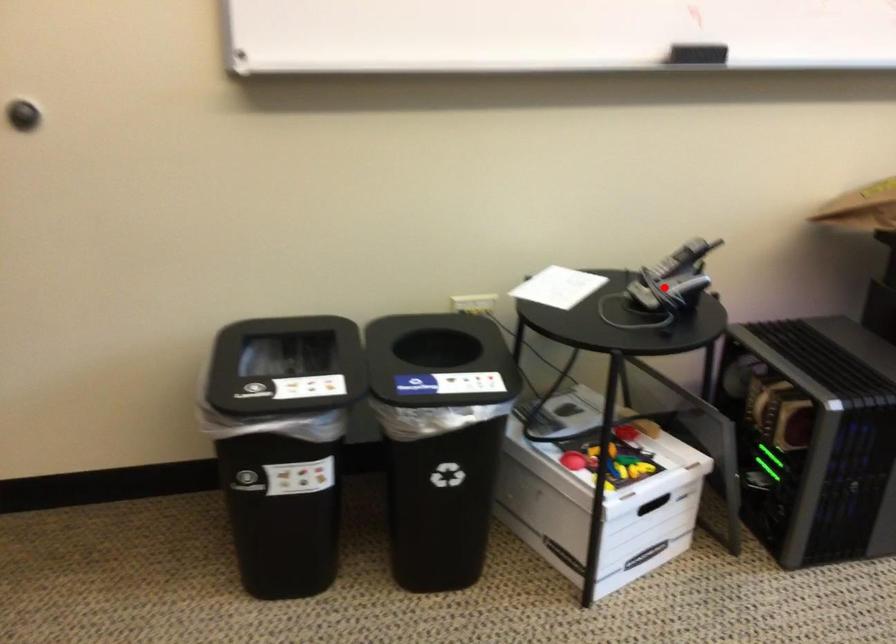
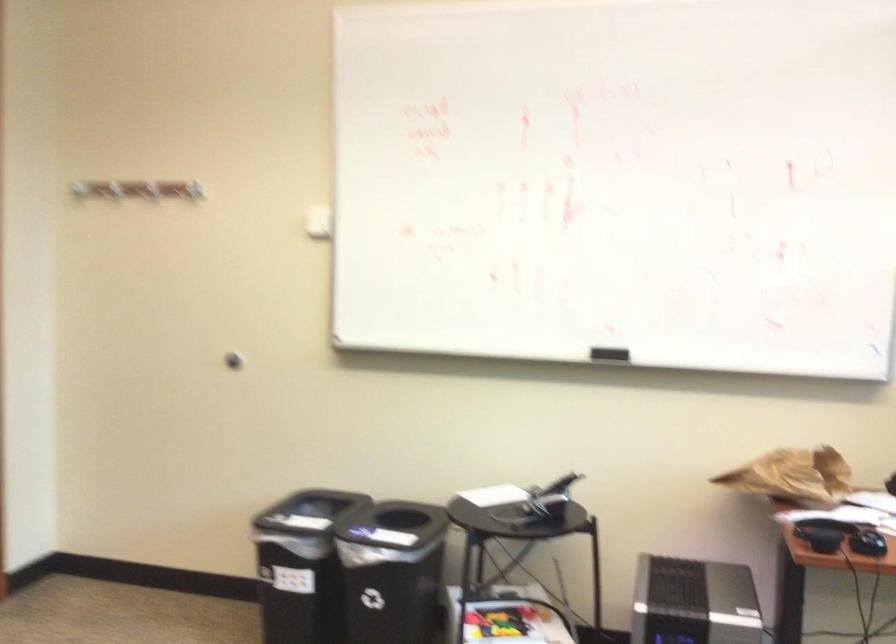
Question: A red point is marked in image1. In image2, is the corresponding 3D point closer to the camera or farther? Reply with the corresponding letter.

Choices:
 (A) The corresponding 3D point is closer.
 (B) The corresponding 3D point is farther.

Answer: (B)